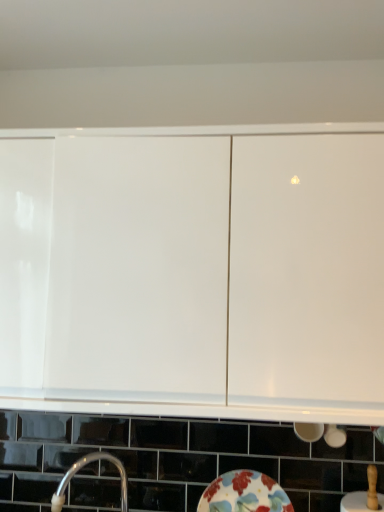
Question: Is the position of white glossy cabinet at upper center less distant than that of floral ceramic plate at lower center?

Choices:
 (A) no
 (B) yes

Answer: (B)

Question: From a real-world perspective, is white glossy cabinet at upper center located beneath floral ceramic plate at lower center?

Choices:
 (A) no
 (B) yes

Answer: (A)

Question: Can you confirm if white glossy cabinet at upper center is shorter than floral ceramic plate at lower center?

Choices:
 (A) yes
 (B) no

Answer: (B)

Question: Are white glossy cabinet at upper center and floral ceramic plate at lower center far apart?

Choices:
 (A) no
 (B) yes

Answer: (A)

Question: Is white glossy cabinet at upper center turned away from floral ceramic plate at lower center?

Choices:
 (A) yes
 (B) no

Answer: (B)

Question: Is white glossy cabinet at upper center inside the boundaries of silver metallic tap at lower left, or outside?

Choices:
 (A) inside
 (B) outside

Answer: (B)

Question: Considering the relative positions of white glossy cabinet at upper center and silver metallic tap at lower left in the image provided, is white glossy cabinet at upper center to the left or to the right of silver metallic tap at lower left?

Choices:
 (A) left
 (B) right

Answer: (B)

Question: Considering their positions, is white glossy cabinet at upper center located in front of or behind silver metallic tap at lower left?

Choices:
 (A) front
 (B) behind

Answer: (A)

Question: Considering the positions of point (86, 250) and point (99, 458), is point (86, 250) closer or farther from the camera than point (99, 458)?

Choices:
 (A) closer
 (B) farther

Answer: (A)

Question: Is point (54, 497) closer or farther from the camera than point (198, 272)?

Choices:
 (A) farther
 (B) closer

Answer: (A)

Question: From their relative heights in the image, would you say silver metallic tap at lower left is taller or shorter than white glossy cabinet at upper center?

Choices:
 (A) tall
 (B) short

Answer: (B)

Question: Is silver metallic tap at lower left inside the boundaries of white glossy cabinet at upper center, or outside?

Choices:
 (A) outside
 (B) inside

Answer: (A)

Question: Is silver metallic tap at lower left wider or thinner than white glossy cabinet at upper center?

Choices:
 (A) thin
 (B) wide

Answer: (A)

Question: From a real-world perspective, is silver metallic tap at lower left physically located above or below floral ceramic plate at lower center?

Choices:
 (A) below
 (B) above

Answer: (B)

Question: Based on their positions, is silver metallic tap at lower left located to the left or right of floral ceramic plate at lower center?

Choices:
 (A) right
 (B) left

Answer: (B)